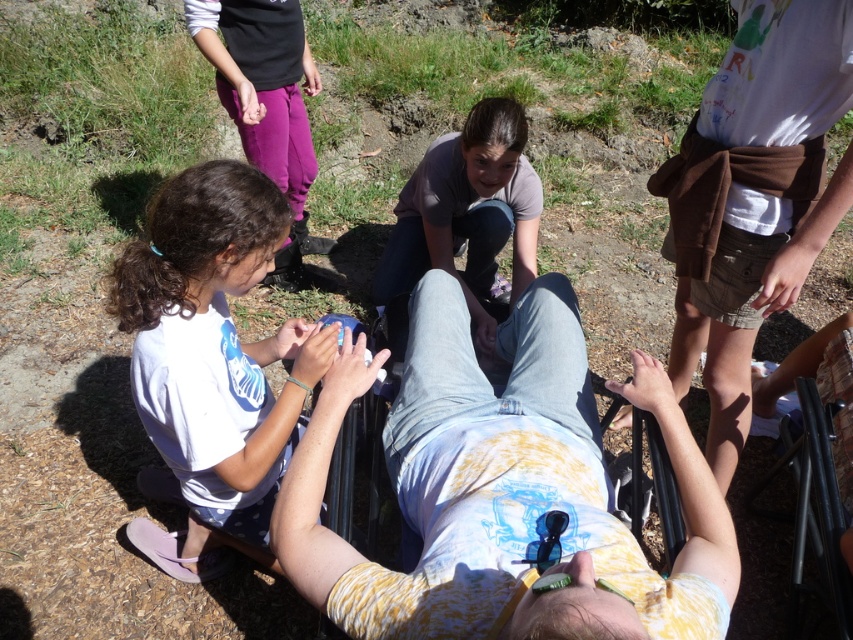
Based on the scene described, can you determine the spatial relationship between the denim jeans at center and the white matte shirt at center?

The denim jeans at center is above the white matte shirt at center.

From the picture: You are a photographer setting up for a group photo. You need to ensure that the denim jeans at center and the matte gray shirt at center are both visible in the shot. Based on their positions, which one should you focus on first to make sure they are both in frame?

The denim jeans at center is located below the matte gray shirt at center. To ensure both are visible, focus on the matte gray shirt at center first as it is higher up, then adjust the frame to include the denim jeans at center below it.